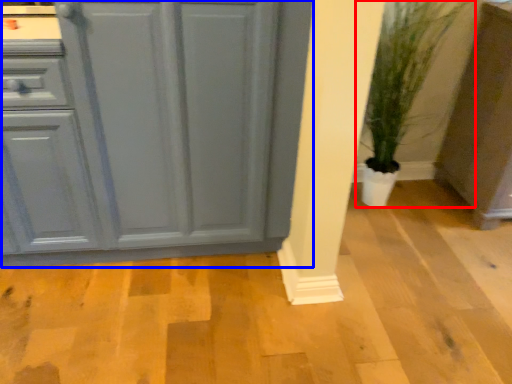
Question: Which point is closer to the camera, houseplant (highlighted by a red box) or cabinetry (highlighted by a blue box)?

Choices:
 (A) houseplant
 (B) cabinetry

Answer: (B)